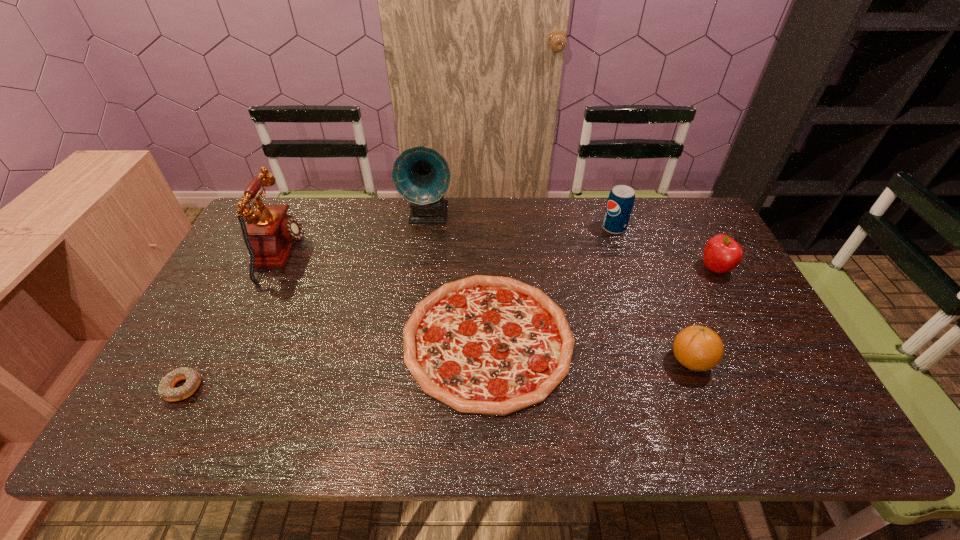
The image size is (960, 540). Identify the location of phonograph_record. (421, 175).

Locate an element on the screen. The height and width of the screenshot is (540, 960). telephone is located at coordinates (271, 233).

I want to click on the fifth shortest object, so click(x=620, y=202).

What are the coordinates of `the rightmost object` in the screenshot? It's located at (722, 254).

Where is `orange`? This screenshot has width=960, height=540. orange is located at coordinates (698, 348).

Image resolution: width=960 pixels, height=540 pixels. In order to click on doughnut in this screenshot , I will do `click(166, 390)`.

Locate an element on the screen. This screenshot has width=960, height=540. pizza is located at coordinates click(493, 345).

The image size is (960, 540). I want to click on vacant space located 0.290m from the horn of the phonograph_record, so click(x=417, y=299).

You are a GUI agent. You are given a task and a screenshot of the screen. Output one action in this format:
    pyautogui.click(x=<x>, y=<y>)
    Task: Click on the free space located 0.330m on the dial of the telephone
    
    Given the screenshot: What is the action you would take?
    [x=410, y=255]

I want to click on free space located on the left of the third tallest object, so tap(502, 228).